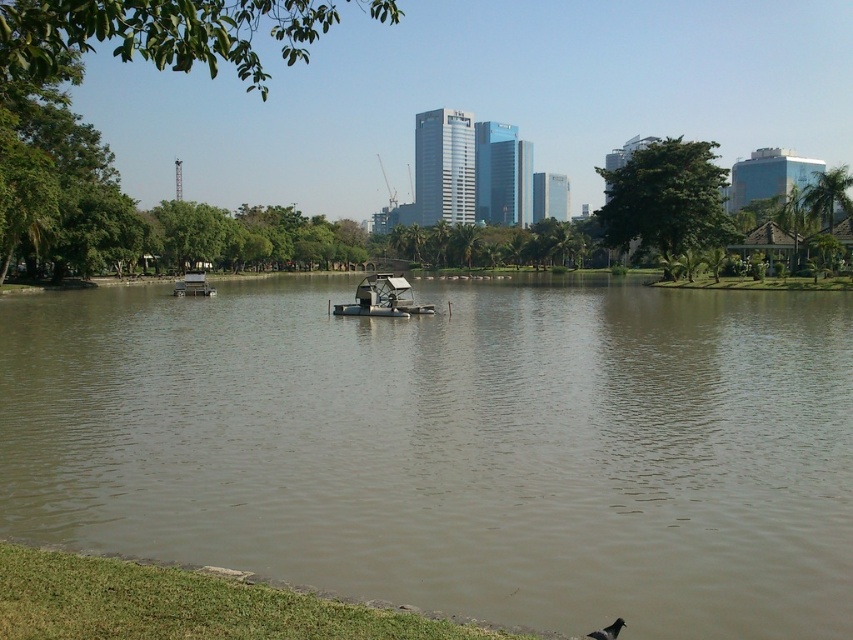
Can you confirm if brown murky water at center is positioned above gray matte bird at lower right?

Yes.

Find the location of `brown murky water at center`. brown murky water at center is located at coordinates (453, 445).

Describe the element at coordinates (453, 445) in the screenshot. The image size is (853, 640). I see `brown murky water at center` at that location.

The width and height of the screenshot is (853, 640). I want to click on brown murky water at center, so (x=453, y=445).

Is point (358, 310) in front of point (190, 288)?

Yes, it is.

Between metallic silver paddlewheel boat at center and white plastic boat at center, which one has less height?

With less height is metallic silver paddlewheel boat at center.

I want to click on metallic silver paddlewheel boat at center, so click(381, 298).

Locate an element on the screen. The image size is (853, 640). metallic silver paddlewheel boat at center is located at coordinates (381, 298).

Who is positioned more to the right, metallic silver paddlewheel boat at center or gray matte bird at lower right?

Positioned to the right is gray matte bird at lower right.

Is point (404, 291) positioned in front of point (619, 625)?

No, (404, 291) is behind (619, 625).

Find the location of a particular element. This screenshot has height=640, width=853. metallic silver paddlewheel boat at center is located at coordinates (381, 298).